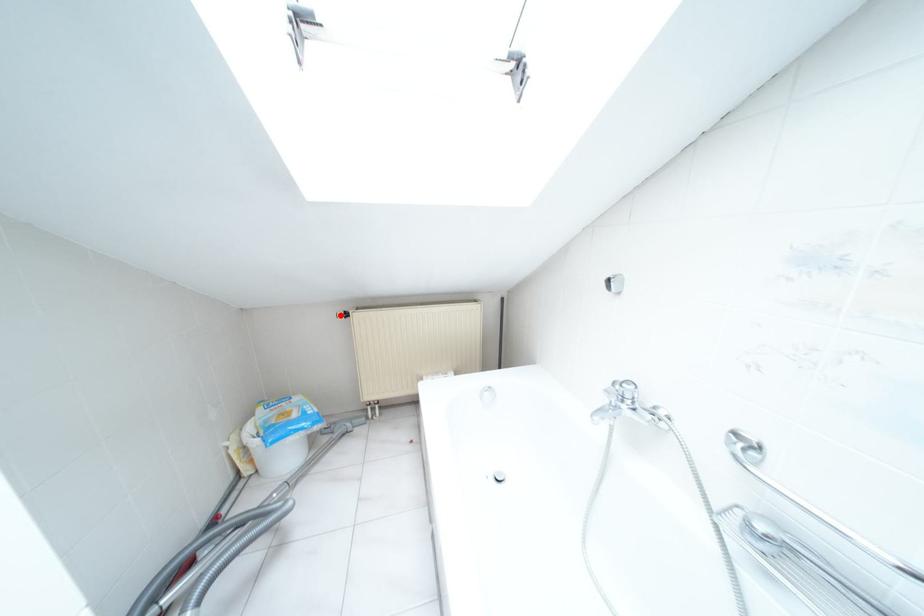
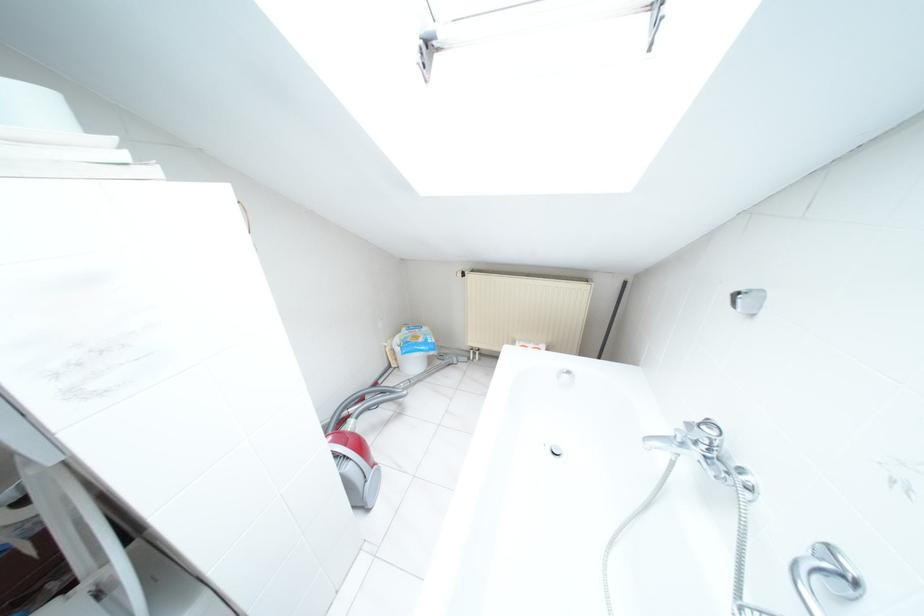
Question: I am providing you with two images of the same scene from different viewpoints. A red point is marked on the first image. Is the red point's position out of view in image 2?

Choices:
 (A) Yes
 (B) No

Answer: (B)